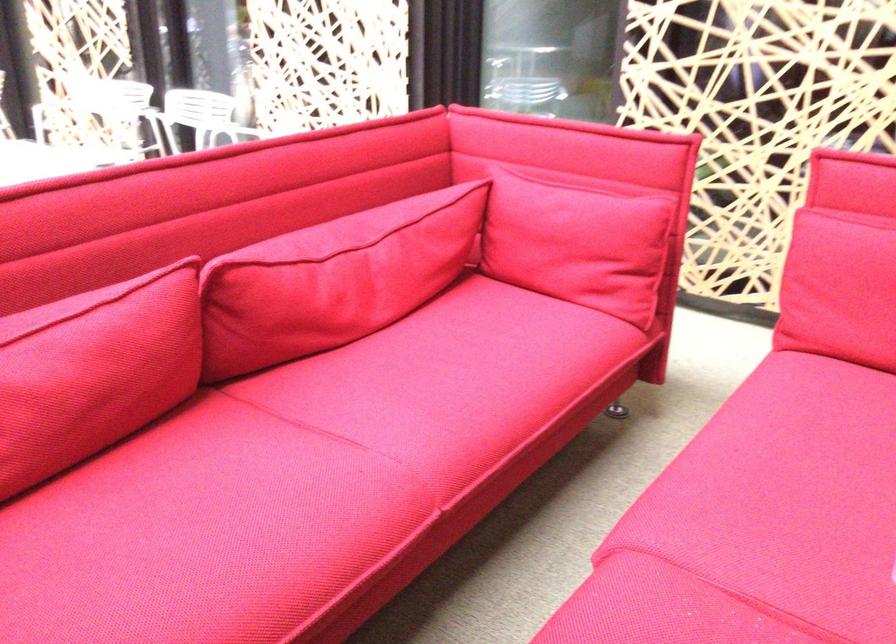
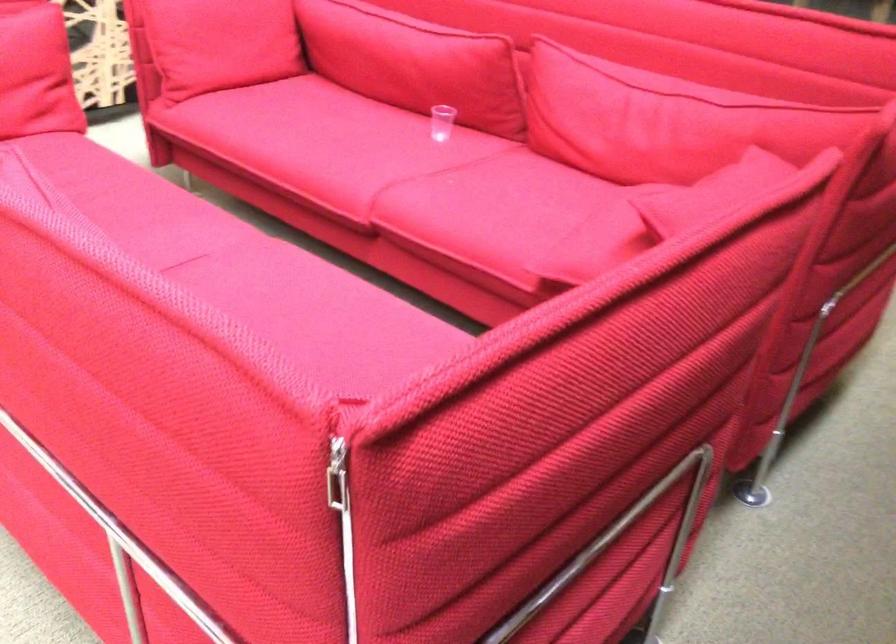
Where in the second image is the point corresponding to pixel 717 448 from the first image?

(320, 146)